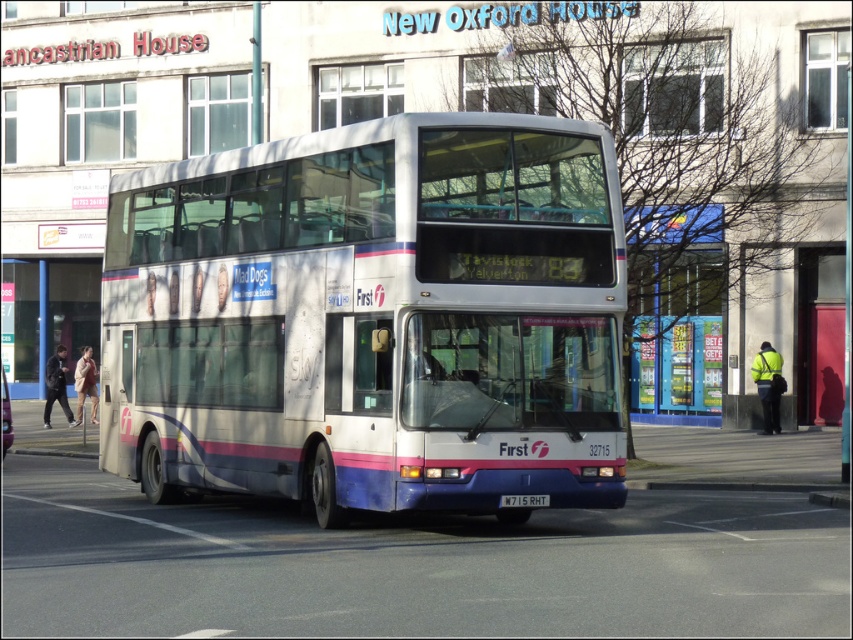
You are standing at the intersection and want to take a photo of the white metallic bus at center. Where should you position yourself to capture it in the frame?

Position yourself at the intersection directly facing the white metallic bus at center located at coordinates point (372, 317) to capture it in the frame.

You are standing in front of the double decker bus and want to reach both the point at coordinates point (x=599, y=216) and the point at coordinates point (x=498, y=504). Which point will you reach first?

You will reach the point at coordinates point (x=599, y=216) first because it is closer to you than the point at coordinates point (x=498, y=504), which is further away.

You are standing at the point with coordinates (372,317) in the image. What object are you standing on?

You are standing on the white metallic bus at center.